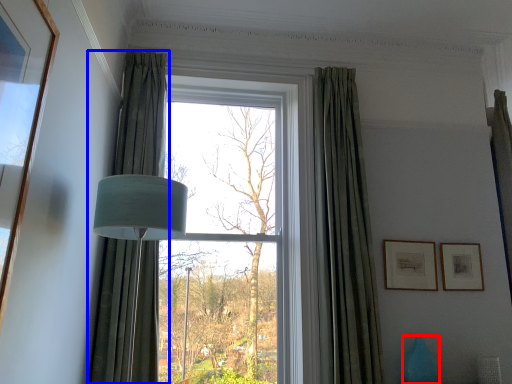
Question: Which point is further to the camera, vase (highlighted by a red box) or curtain (highlighted by a blue box)?

Choices:
 (A) vase
 (B) curtain

Answer: (A)